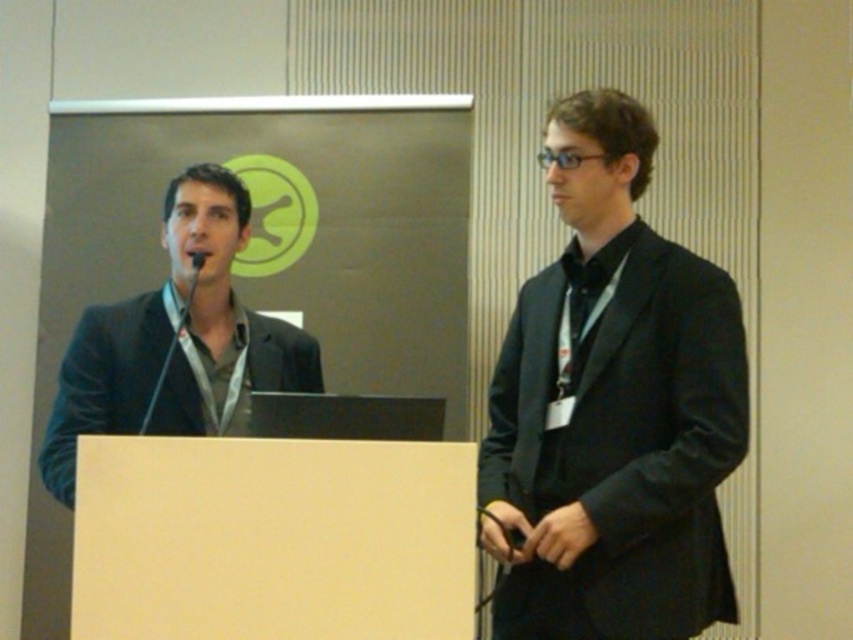
You are an event organizer who needs to place a 12 inch wide decorative plaque between the black matte suit at center and the matte black suit at left. Is there enough space between them to fit the plaque?

The black matte suit at center and the matte black suit at left are 32.88 inches apart, so yes, the 12 inch wide decorative plaque can fit between them since the distance is greater than the plaque width.

You are organizing a charity event and need to decide which of the two matte black suits to use for the main speaker. The black matte suit at center and the matte black suit at left are available. Based on the image, which one is more suitable for a speaker who prefers a slimmer silhouette?

The black matte suit at center is thinner than the matte black suit at left, so it would be more suitable for a speaker who prefers a slimmer silhouette.